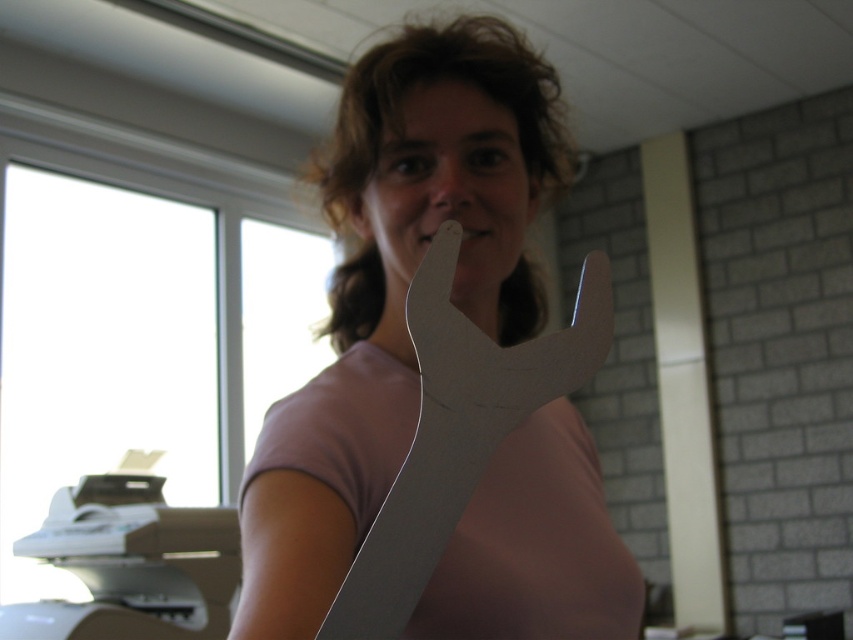
You are an office worker who needs to place both the matte white wrench at center and the white cardboard knife at center on a shelf that is 18 inches wide. Can both items fit side by side on the shelf without overlapping?

The matte white wrench at center and white cardboard knife at center are 18.58 inches apart, so they cannot fit side by side on an 18 inch shelf without overlapping.

You are an office worker who needs to store the matte white wrench at center and the white cardboard knife at center in a drawer. The drawer has a width of 15 cm. Can both items fit side by side without overlapping?

The matte white wrench at center might be wider than white cardboard knife at center. If the combined width of both items exceeds 15 cm, they might not fit side by side. However, since the exact widths aren

You are an office worker who needs to reach for a wrench to fix a broken printer. You see a matte white wrench at center and a metallic silver wrench at center. Which wrench can you grab first without moving the other?

The matte white wrench at center can be grabbed first because the metallic silver wrench at center is behind it, making it more accessible.